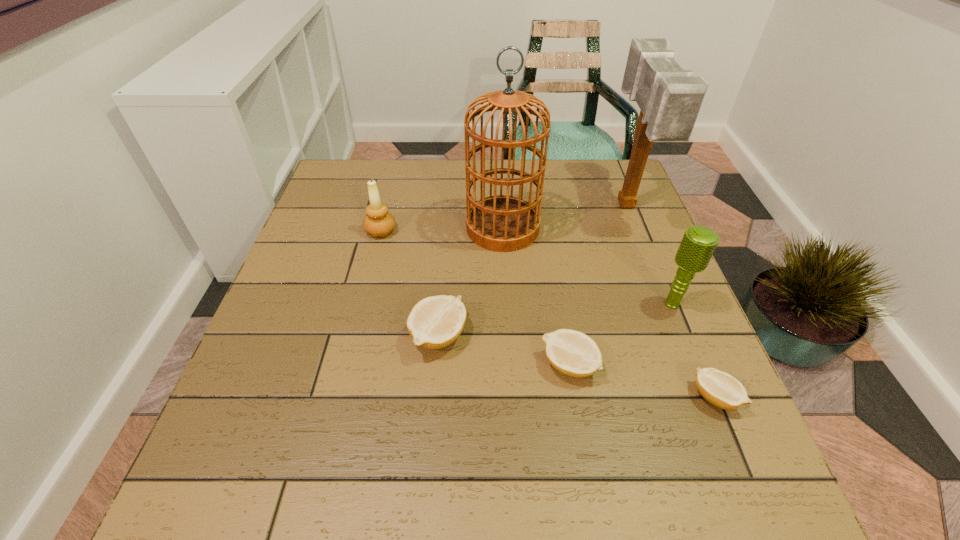
Where is `object that is at the left edge`? This screenshot has height=540, width=960. object that is at the left edge is located at coordinates (378, 222).

Where is `lemon situated at the right edge`? The image size is (960, 540). lemon situated at the right edge is located at coordinates (719, 388).

Locate an element on the screen. The width and height of the screenshot is (960, 540). mallet that is positioned at the right edge is located at coordinates (669, 98).

Identify the location of microphone that is at the right edge. Image resolution: width=960 pixels, height=540 pixels. (698, 244).

Locate an element on the screen. This screenshot has height=540, width=960. object at the far right corner is located at coordinates (669, 98).

At what (x,y) coordinates should I click in order to perform the action: click on object situated at the near right corner. Please return your answer as a coordinate pair (x, y). The height and width of the screenshot is (540, 960). Looking at the image, I should click on (719, 388).

Locate an element on the screen. The height and width of the screenshot is (540, 960). free location at the far edge is located at coordinates (395, 165).

Where is `vacant space at the left edge of the desktop`? The height and width of the screenshot is (540, 960). vacant space at the left edge of the desktop is located at coordinates (296, 334).

You are a GUI agent. You are given a task and a screenshot of the screen. Output one action in this format:
    pyautogui.click(x=<x>, y=<y>)
    Task: Click on the free region at the right edge
    Image resolution: width=960 pixels, height=540 pixels.
    Given the screenshot: What is the action you would take?
    pyautogui.click(x=614, y=236)

What are the coordinates of `vacant area at the near left corner` in the screenshot? It's located at (291, 433).